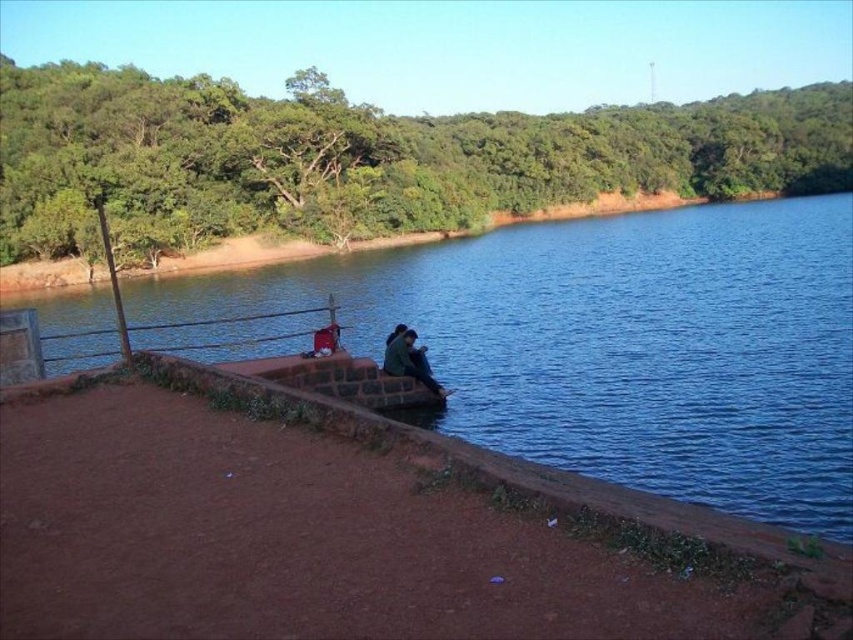
Is point (613, 368) farther from viewer compared to point (410, 344)?

Yes, point (613, 368) is behind point (410, 344).

Who is more distant from viewer, (299, 346) or (399, 330)?

The point (299, 346) is behind.

Locate an element on the screen. blue water at center is located at coordinates (614, 344).